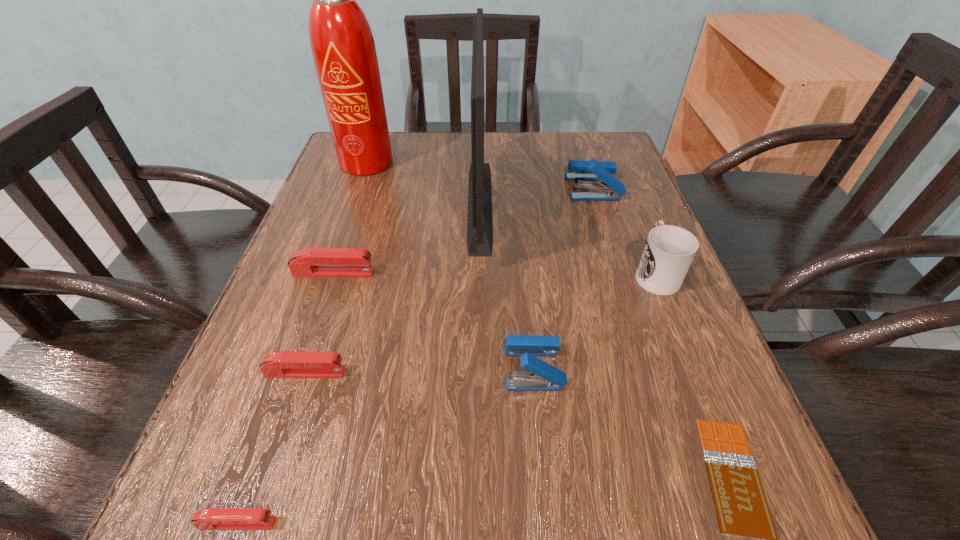
Locate an element on the screen. fire extinguisher is located at coordinates (342, 44).

Where is `red fire extinguisher`? The height and width of the screenshot is (540, 960). red fire extinguisher is located at coordinates (342, 44).

Where is `monitor`? monitor is located at coordinates (479, 222).

The image size is (960, 540). In order to click on the eighth shortest object in this screenshot , I will do `click(479, 222)`.

Find the location of a particular element. The height and width of the screenshot is (540, 960). cup is located at coordinates (669, 250).

Where is `the rightmost stapler`? The width and height of the screenshot is (960, 540). the rightmost stapler is located at coordinates (592, 170).

Find the location of a particular element. Image resolution: width=960 pixels, height=540 pixels. the right blue stapler is located at coordinates (592, 170).

The height and width of the screenshot is (540, 960). What are the coordinates of `the second tallest stapler` in the screenshot? It's located at (542, 376).

This screenshot has height=540, width=960. What are the coordinates of `the fourth stapler from left to right` in the screenshot? It's located at (542, 376).

Where is `the fourth nearest stapler`? the fourth nearest stapler is located at coordinates (311, 262).